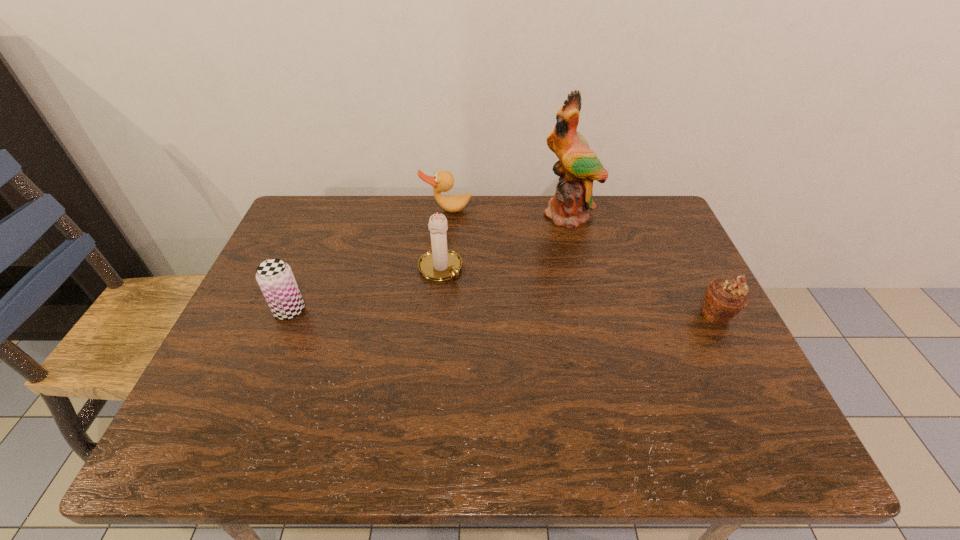
The image size is (960, 540). In order to click on free spot on the desktop that is between the beer can and the rightmost object and is positioned on the front-facing side of the fourth object from left to right in this screenshot , I will do `click(545, 313)`.

Locate an element on the screen. Image resolution: width=960 pixels, height=540 pixels. free space on the desktop that is between the leftmost object and the muffin and is positioned on the beak of the duck is located at coordinates (449, 312).

Identify the location of vacant spot on the desktop that is between the beer can and the rightmost object and is positioned on the handle side of the candle holder. The image size is (960, 540). (486, 312).